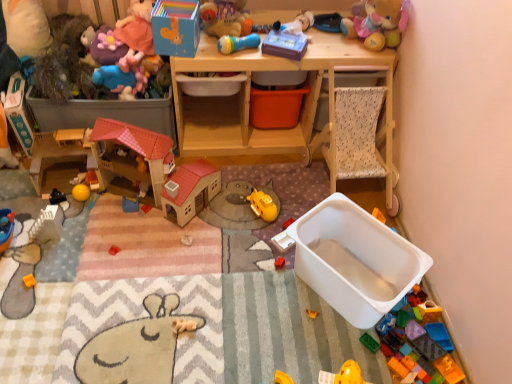
I want to click on free region on the left part of blue plastic toy at center, which ranks as the 8th toy in right-to-left order, so click(x=98, y=210).